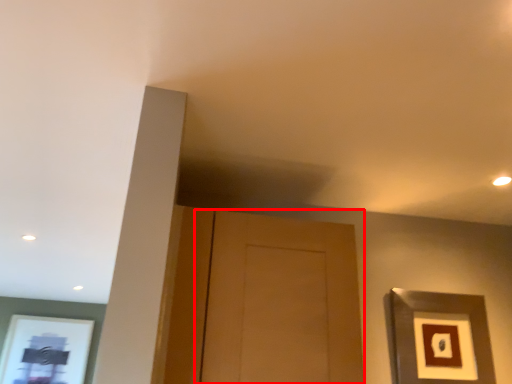
Question: From the image's perspective, considering the relative positions of door (annotated by the red box) and picture frame in the image provided, where is door (annotated by the red box) located with respect to the staircase?

Choices:
 (A) below
 (B) above

Answer: (B)